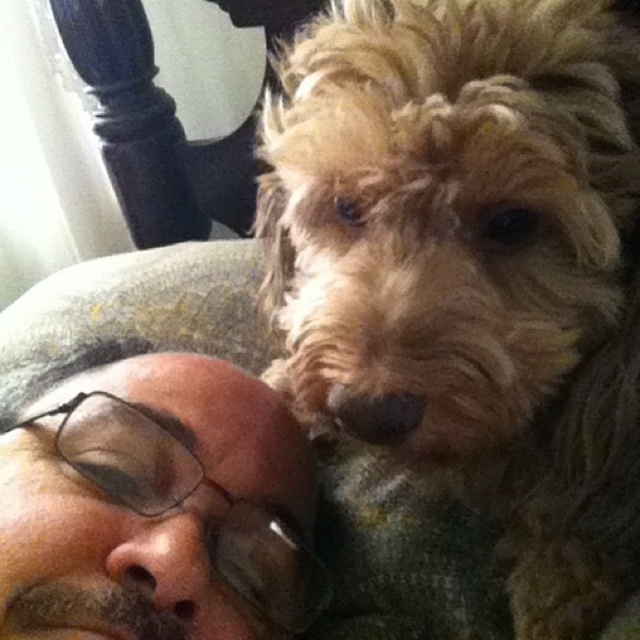
Question: Is fuzzy golden fur at center closer to the viewer compared to brown matte glasses at upper left?

Choices:
 (A) yes
 (B) no

Answer: (A)

Question: Which object appears farthest from the camera in this image?

Choices:
 (A) fuzzy golden fur at center
 (B) brown matte glasses at upper left

Answer: (B)

Question: Which point is closer to the camera?

Choices:
 (A) (294, 392)
 (B) (193, 484)

Answer: (B)

Question: Is fuzzy golden fur at center to the right of brown matte glasses at upper left from the viewer's perspective?

Choices:
 (A) yes
 (B) no

Answer: (A)

Question: Is fuzzy golden fur at center wider than brown matte glasses at upper left?

Choices:
 (A) yes
 (B) no

Answer: (A)